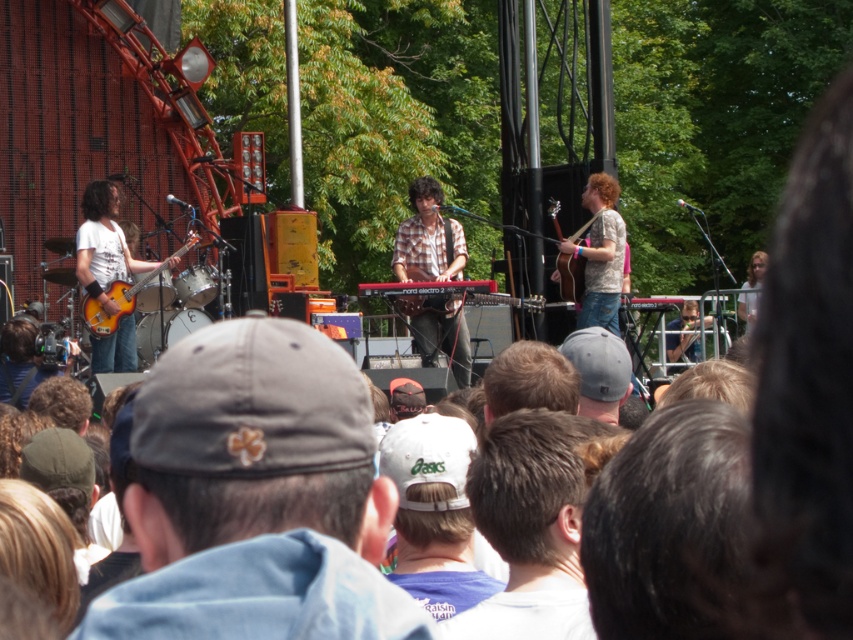
Question: Which point is closer to the camera?

Choices:
 (A) (564, 276)
 (B) (223, 342)

Answer: (B)

Question: Which object is closer to the camera taking this photo?

Choices:
 (A) matte yellow guitar at left
 (B) denim cap at center
 (C) dark brown hair at center
 (D) light brown hair at right

Answer: (C)

Question: Which of the following is the closest to the observer?

Choices:
 (A) plaid shirt at center
 (B) light brown hair at right

Answer: (A)

Question: Is plaid shirt at center positioned in front of matte yellow guitar at left?

Choices:
 (A) yes
 (B) no

Answer: (A)

Question: From the image, what is the correct spatial relationship of plaid shirt at center in relation to matte yellow guitar at left?

Choices:
 (A) left
 (B) right

Answer: (B)

Question: Does dark brown hair at center have a smaller size compared to wooden acoustic guitar at right?

Choices:
 (A) no
 (B) yes

Answer: (A)